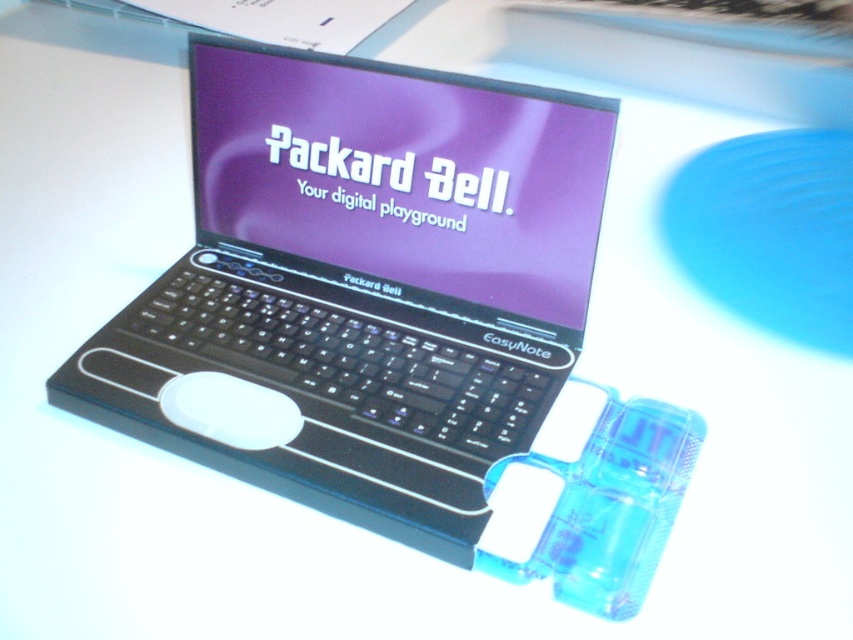
Question: Does black plastic laptop at center have a smaller size compared to white matte mouse at center?

Choices:
 (A) no
 (B) yes

Answer: (A)

Question: Is black plastic laptop at center positioned before white matte mouse at center?

Choices:
 (A) no
 (B) yes

Answer: (B)

Question: Which point appears closest to the camera in this image?

Choices:
 (A) (223, 388)
 (B) (236, 346)

Answer: (A)

Question: Does black plastic laptop at center come in front of white matte mouse at center?

Choices:
 (A) yes
 (B) no

Answer: (A)